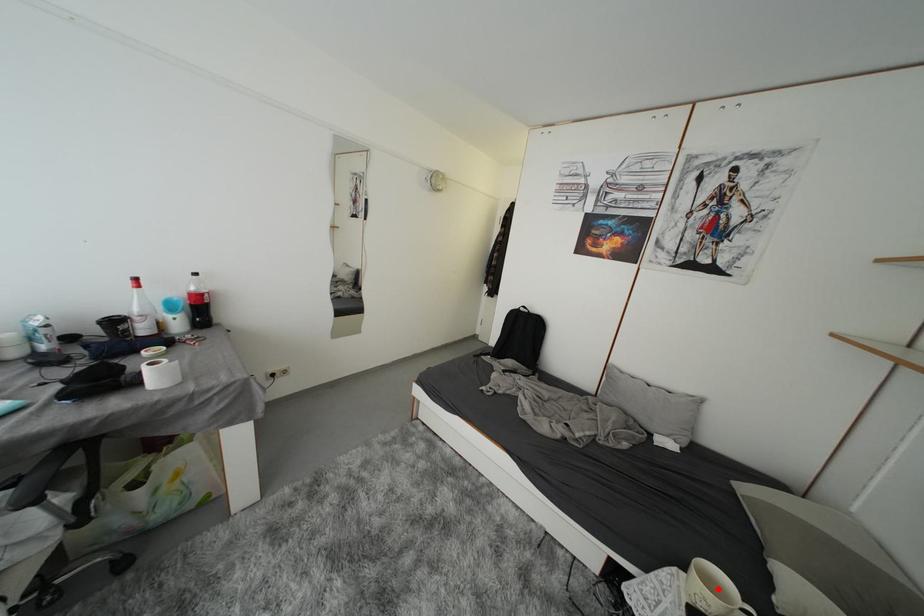
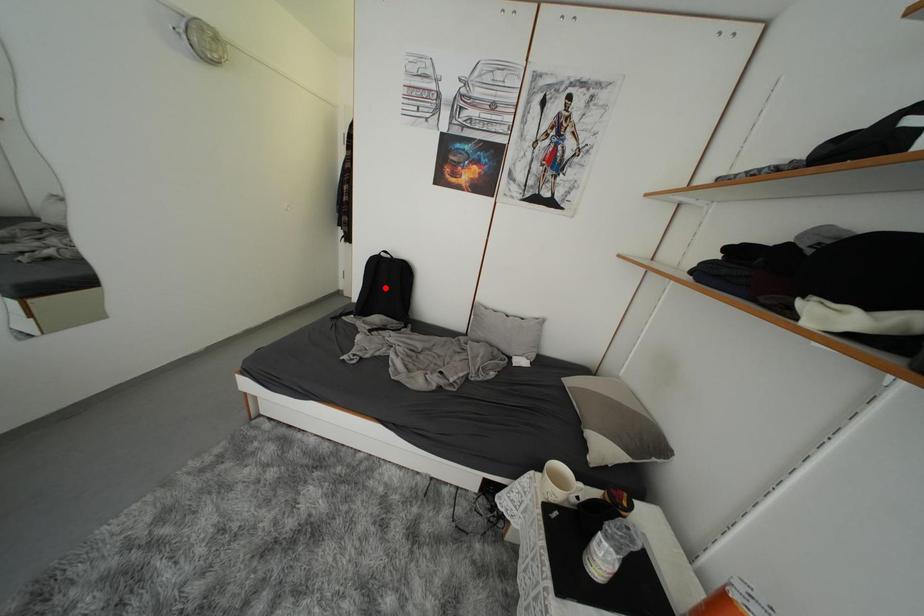
I am providing you with two images of the same scene from different viewpoints. A red point is marked on the first image and another point is marked on the second image. Do the highlighted points in image1 and image2 indicate the same real-world spot?

No